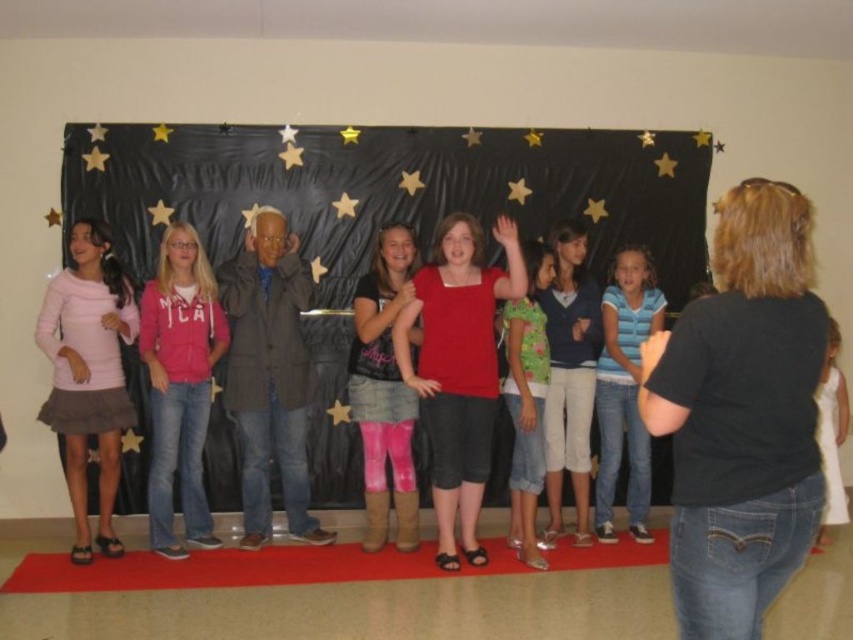
Image resolution: width=853 pixels, height=640 pixels. Describe the element at coordinates (384, 390) in the screenshot. I see `pink tie-dye leggings at center` at that location.

Is pink tie-dye leggings at center closer to the viewer compared to white satin dress at center?

Yes, pink tie-dye leggings at center is in front of white satin dress at center.

Between point (399, 419) and point (817, 445), which one is positioned in front?

Point (817, 445) is more forward.

Where is `pink tie-dye leggings at center`? This screenshot has width=853, height=640. pink tie-dye leggings at center is located at coordinates (384, 390).

Can you confirm if black t-shirt at right is taller than white satin dress at center?

Incorrect, black t-shirt at right's height is not larger of white satin dress at center's.

Consider the image. How much distance is there between black t-shirt at right and white satin dress at center?

A distance of 2.60 meters exists between black t-shirt at right and white satin dress at center.

Where is `black t-shirt at right`? This screenshot has width=853, height=640. black t-shirt at right is located at coordinates (741, 413).

Does black t-shirt at right have a smaller size compared to denim shorts at center?

Yes.

From the picture: Between black t-shirt at right and denim shorts at center, which one appears on the right side from the viewer's perspective?

black t-shirt at right

Who is more distant from viewer, (786,390) or (558,468)?

Point (558,468)

Where is `black t-shirt at right`? black t-shirt at right is located at coordinates (741, 413).